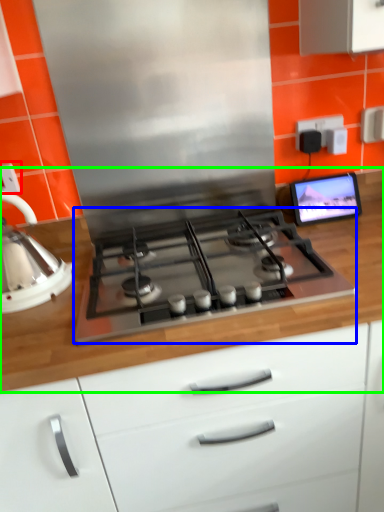
Question: Based on their relative distances, which object is farther from electric outlet (highlighted by a red box)? Choose from gas stove (highlighted by a blue box) and countertop (highlighted by a green box).

Choices:
 (A) gas stove
 (B) countertop

Answer: (B)